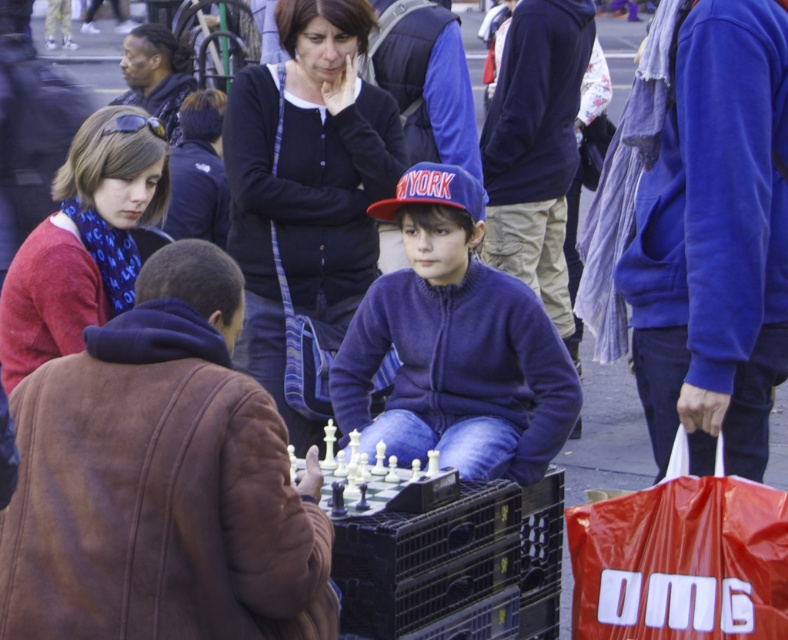
Question: Is dark blue cardigan at center thinner than red plastic bag at lower right?

Choices:
 (A) yes
 (B) no

Answer: (B)

Question: Which of the following is the closest to the observer?

Choices:
 (A) (158, 58)
 (B) (91, 513)
 (C) (87, 168)
 (D) (645, 310)

Answer: (B)

Question: Is dark blue cardigan at center to the left of matte red sweater at left from the viewer's perspective?

Choices:
 (A) yes
 (B) no

Answer: (B)

Question: Which point appears closest to the camera in this image?

Choices:
 (A) (188, 72)
 (B) (285, 17)
 (C) (690, 561)
 (D) (433, 371)

Answer: (C)

Question: Can you confirm if velvet blue hoodie at right is positioned to the left of dark blue cardigan at center?

Choices:
 (A) yes
 (B) no

Answer: (B)

Question: Which of these objects is positioned farthest from the dark blue sweater at upper center?

Choices:
 (A) brown suede jacket at lower left
 (B) dark blue hoodie at center

Answer: (A)